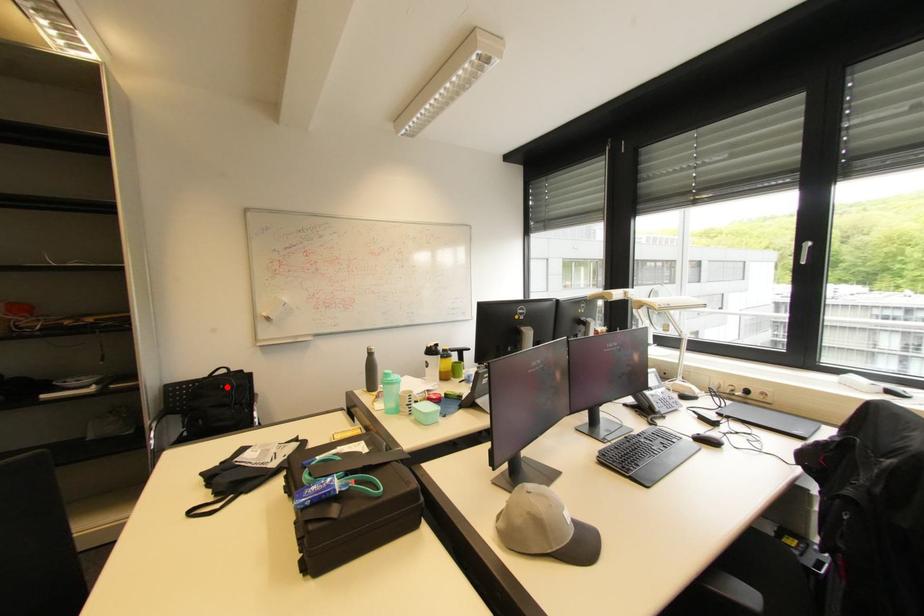
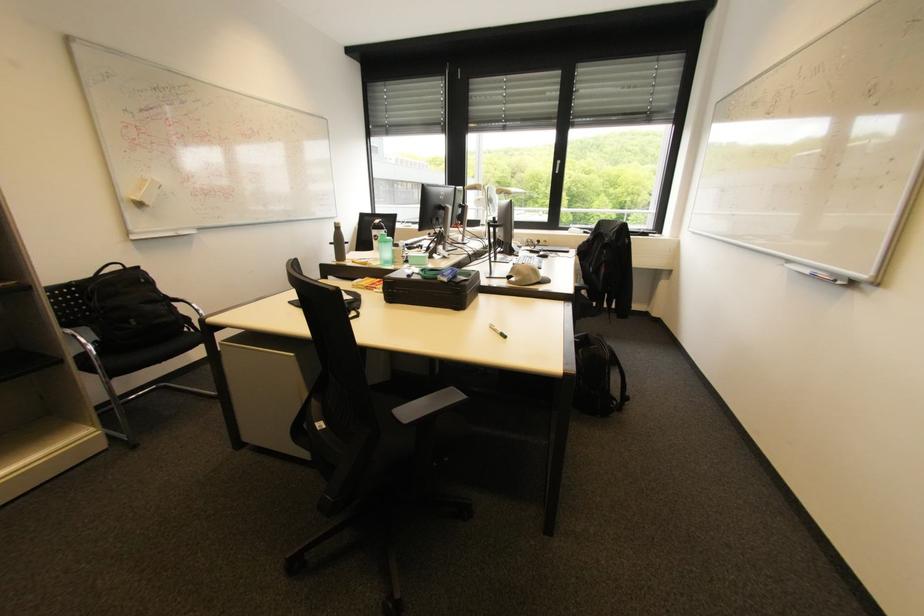
Where in the second image is the point corresponding to the highlighted location from the first image?

(148, 281)